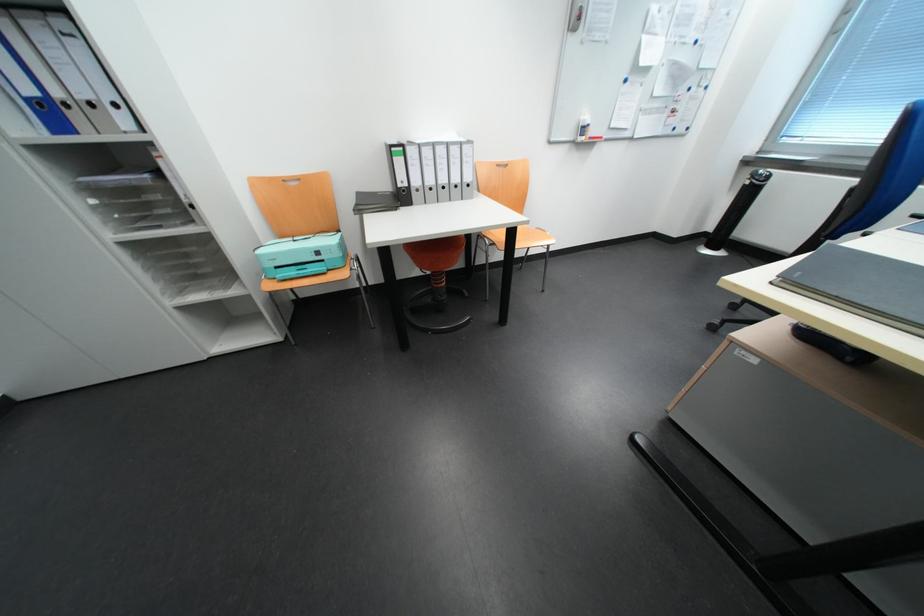
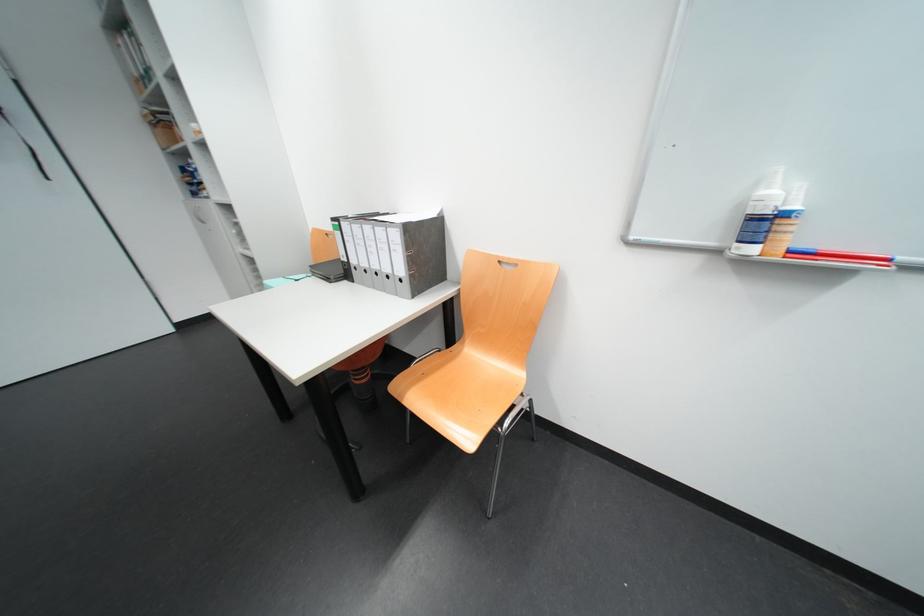
Where in the second image is the point corresponding to (x=593, y=120) from the first image?

(773, 193)